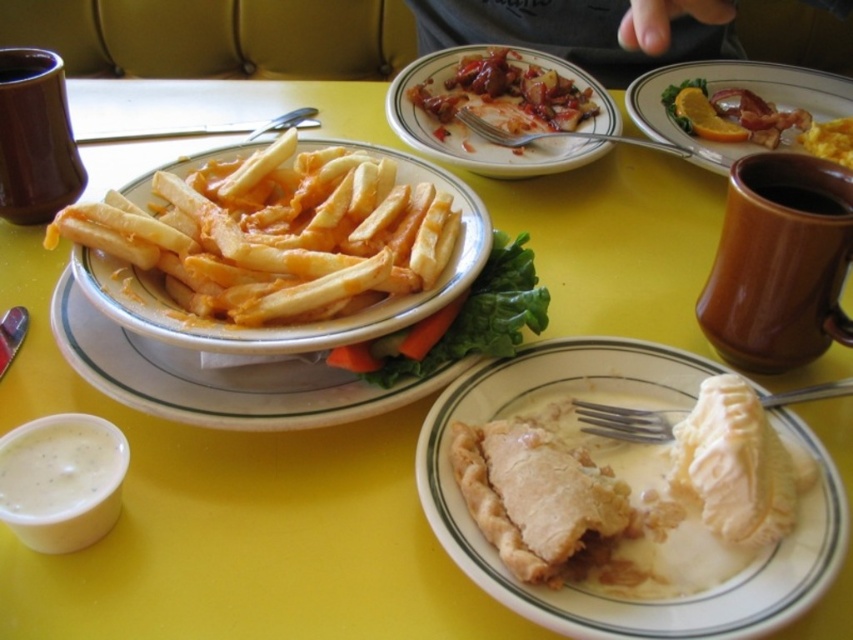
You are a customer at the diner and want to reach for the matte white pie at center and the golden crispy fries at center. Which one is closer to you?

The matte white pie at center is located below the golden crispy fries at center, so the golden crispy fries at center is closer to you.